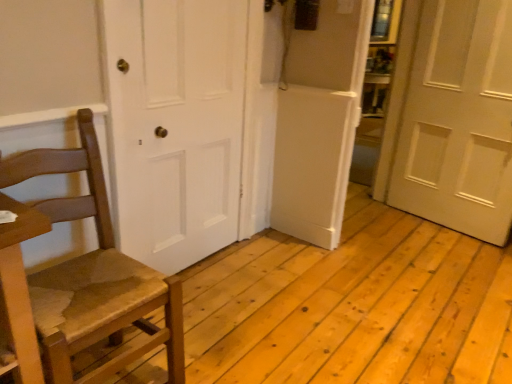
Question: Considering the relative positions of white matte door at center, which is counted as the 1th door, starting from the left, and wooden chair at left in the image provided, is white matte door at center, which is counted as the 1th door, starting from the left, to the right of wooden chair at left from the viewer's perspective?

Choices:
 (A) yes
 (B) no

Answer: (A)

Question: From the image's perspective, would you say white matte door at center, which is counted as the 1th door, starting from the left, is shown under wooden chair at left?

Choices:
 (A) no
 (B) yes

Answer: (A)

Question: Is white matte door at center, which is counted as the 1th door, starting from the left, bigger than wooden chair at left?

Choices:
 (A) yes
 (B) no

Answer: (B)

Question: Is the position of white matte door at center, which is counted as the 1th door, starting from the left, more distant than that of wooden chair at left?

Choices:
 (A) no
 (B) yes

Answer: (B)

Question: Does white matte door at center, which is counted as the 1th door, starting from the left, turn towards wooden chair at left?

Choices:
 (A) yes
 (B) no

Answer: (B)

Question: From a real-world perspective, is wooden chair at left positioned above or below white matte door at right, the second door in the left-to-right sequence?

Choices:
 (A) below
 (B) above

Answer: (A)

Question: Would you say wooden chair at left is to the left or to the right of white matte door at right, the second door in the left-to-right sequence, in the picture?

Choices:
 (A) left
 (B) right

Answer: (A)

Question: Based on their sizes in the image, would you say wooden chair at left is bigger or smaller than white matte door at right, positioned as the first door in right-to-left order?

Choices:
 (A) small
 (B) big

Answer: (B)

Question: Considering the positions of wooden chair at left and white matte door at right, positioned as the first door in right-to-left order, in the image, is wooden chair at left taller or shorter than white matte door at right, positioned as the first door in right-to-left order,?

Choices:
 (A) tall
 (B) short

Answer: (B)

Question: From the image's perspective, is white matte door at center, which ranks as the 2th door in right-to-left order, positioned above or below white matte door at right, the second door in the left-to-right sequence?

Choices:
 (A) above
 (B) below

Answer: (B)

Question: Looking at their shapes, would you say white matte door at center, which ranks as the 2th door in right-to-left order, is wider or thinner than white matte door at right, the second door in the left-to-right sequence?

Choices:
 (A) wide
 (B) thin

Answer: (B)

Question: Would you say white matte door at center, which ranks as the 2th door in right-to-left order, is inside or outside white matte door at right, positioned as the first door in right-to-left order?

Choices:
 (A) outside
 (B) inside

Answer: (A)

Question: Would you say white matte door at center, which ranks as the 2th door in right-to-left order, is to the left or to the right of white matte door at right, positioned as the first door in right-to-left order, in the picture?

Choices:
 (A) right
 (B) left

Answer: (B)

Question: Would you say white matte door at right, positioned as the first door in right-to-left order, is to the left or to the right of wooden chair at left in the picture?

Choices:
 (A) right
 (B) left

Answer: (A)

Question: From the image's perspective, relative to wooden chair at left, is white matte door at right, positioned as the first door in right-to-left order, above or below?

Choices:
 (A) below
 (B) above

Answer: (B)